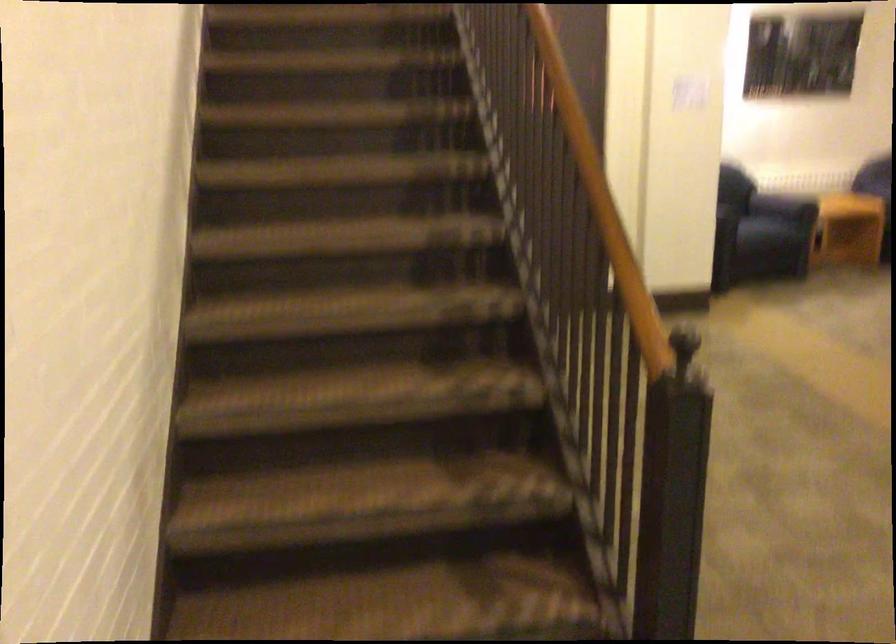
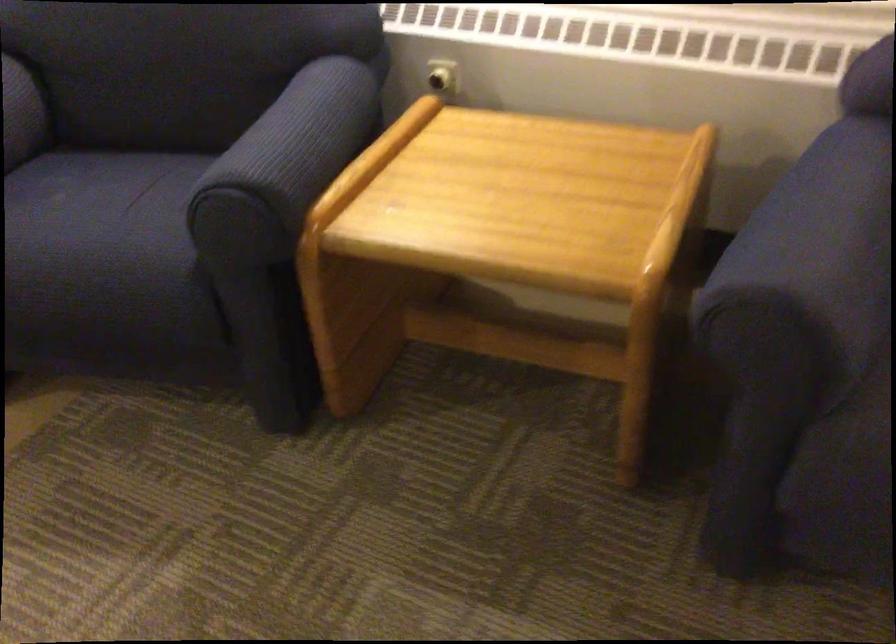
The point at [821,182] is marked in the first image. Where is the corresponding point in the second image?

(295, 144)